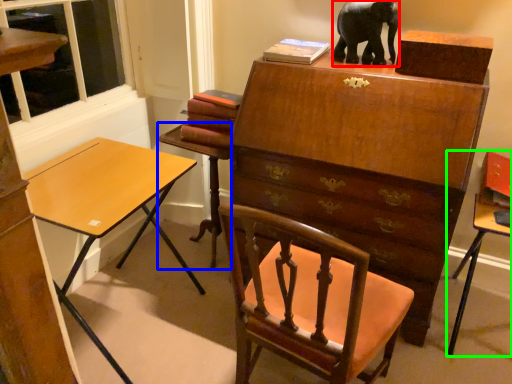
Question: Which object is positioned farthest from elephant (highlighted by a red box)? Select from table (highlighted by a blue box) and table (highlighted by a green box).

Choices:
 (A) table
 (B) table

Answer: (A)